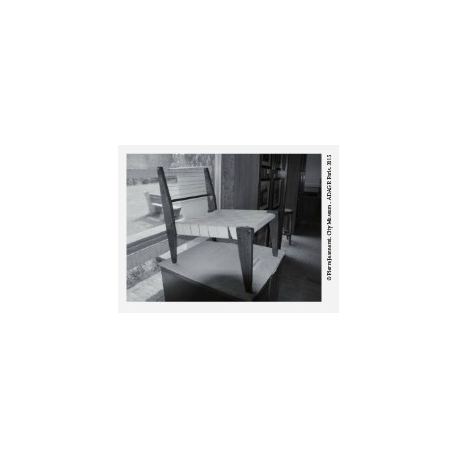
Find the location of a particular element. This screenshot has height=458, width=458. window is located at coordinates (139, 203), (139, 223).